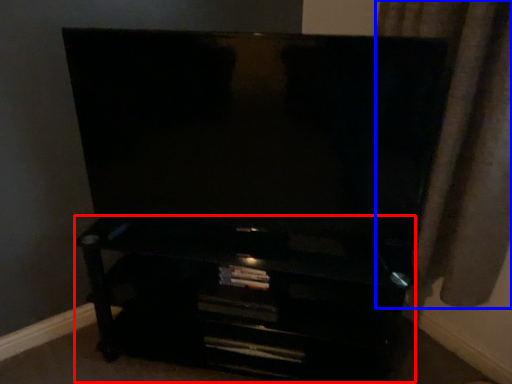
Question: Among these objects, which one is farthest to the camera, entertainment center (highlighted by a red box) or curtain (highlighted by a blue box)?

Choices:
 (A) entertainment center
 (B) curtain

Answer: (A)